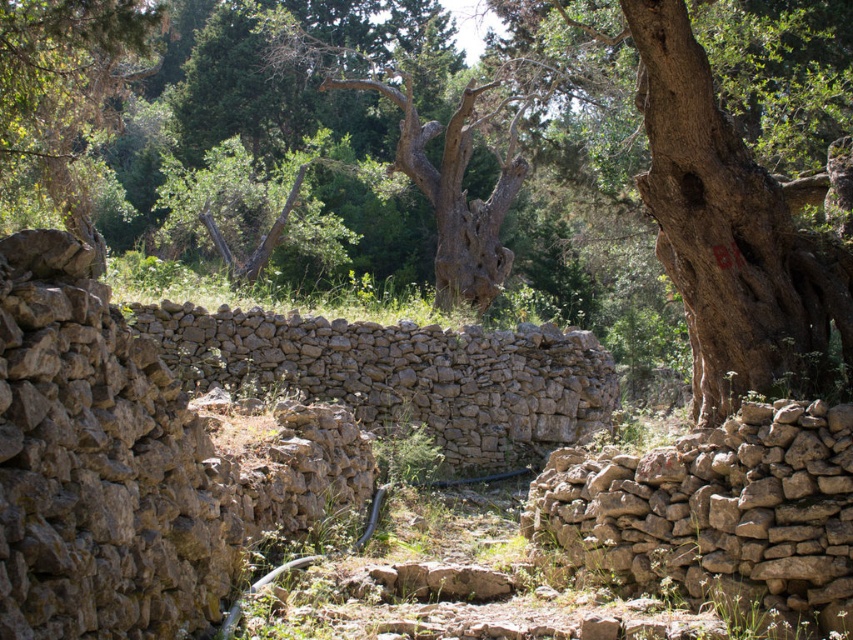
You are a hiker who needs to cross a river that flows between the smooth brown tree trunk at center and the brown rough stone at right. The river is 15 meters wide. Can you safely cross the river using a 16 meter long bridge placed between them?

The distance between the smooth brown tree trunk at center and the brown rough stone at right is 16.02 meters. Since the bridge is 16 meters long, it is slightly shorter than the required distance, so the bridge would not span the entire gap. Therefore, you cannot safely cross the river using this bridge.

You are standing at the center of the image and want to place a small flag at each of the two points labeled point (846, 204) and point (763, 468). Which point will have its flag closer to you when viewed from your current position?

Point (763, 468) is closer to you than point (846, 204), so the flag at point (763, 468) will be closer to you.